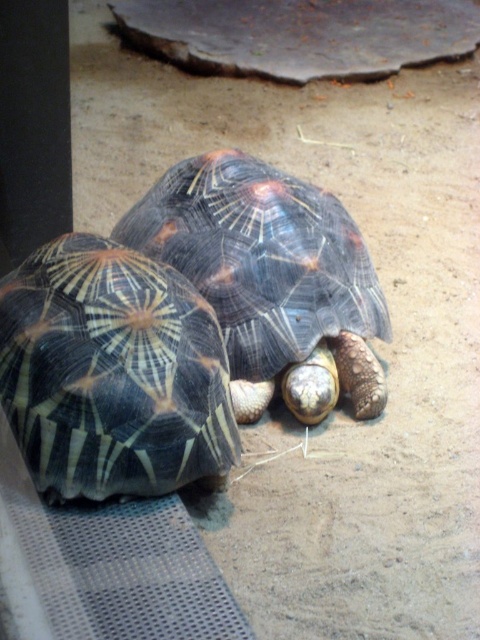
You are a zookeeper observing two tortoises in their enclosure. You notice the shiny black tortoise at center and the shiny dark tortoise at center. Which tortoise is positioned closer to you?

The shiny black tortoise at center is closer to the viewer than the shiny dark tortoise at center.

You are observing two points in an enclosure with radiated tortoises. The points are labeled as point (131, 368) and point (250, 384). Based on their positions, which point is nearer to you?

Point (131, 368) is closer to the camera than point (250, 384), so it is the nearer point.